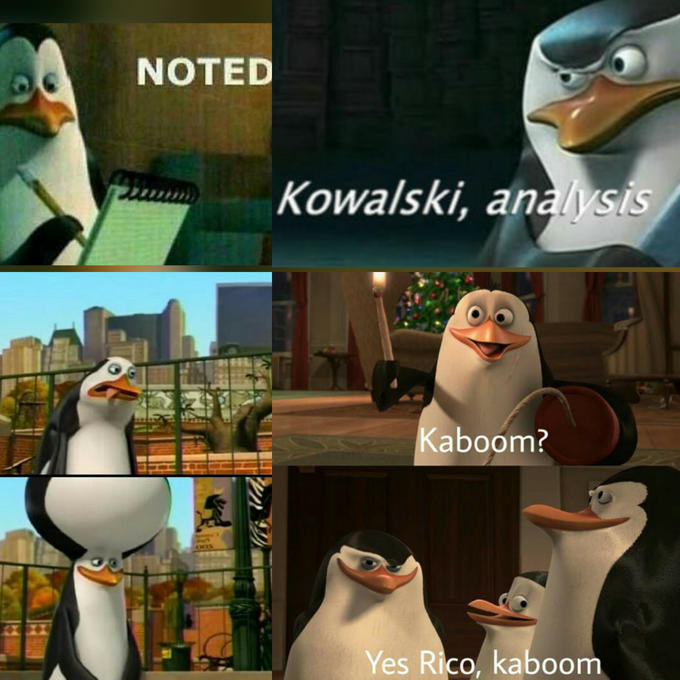
You are a GUI agent. You are given a task and a screenshot of the screen. Output one action in this format:
    pyautogui.click(x=<x>, y=<y>)
    Task: Click on the candle
    This screenshot has width=680, height=680.
    Given the screenshot: What is the action you would take?
    pyautogui.click(x=389, y=341)